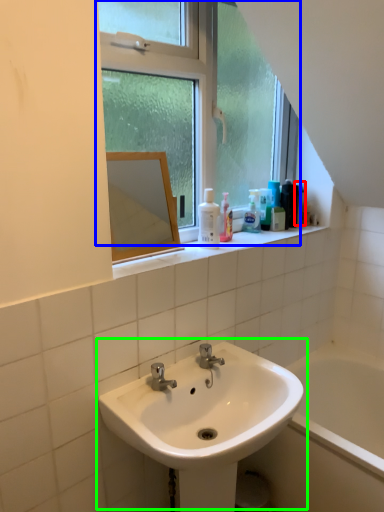
Question: Which object is the closest to the mouthwash (highlighted by a red box)? Choose among these: window (highlighted by a blue box) or sink (highlighted by a green box).

Choices:
 (A) window
 (B) sink

Answer: (A)